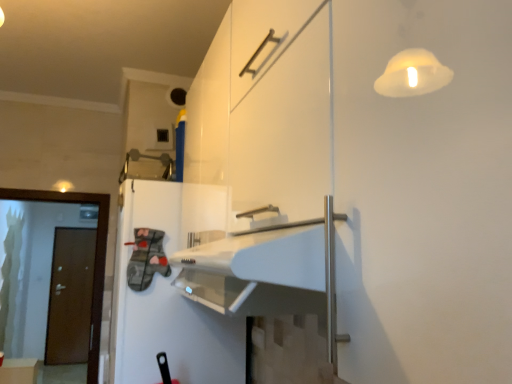
Question: From the image's perspective, relative to brown matte door at left, is brown matte door at left above or below?

Choices:
 (A) below
 (B) above

Answer: (B)

Question: Considering the positions of brown matte door at left and brown matte door at left in the image, is brown matte door at left bigger or smaller than brown matte door at left?

Choices:
 (A) small
 (B) big

Answer: (A)

Question: Which object is positioned closest to the white glossy refrigerator at center?

Choices:
 (A) matte white cabinet at lower left
 (B) brown matte door at left
 (C) brown matte door at left

Answer: (C)

Question: Considering the real-world distances, which object is closest to the brown matte door at left?

Choices:
 (A) brown matte door at left
 (B) matte white cabinet at lower left
 (C) white glossy refrigerator at center

Answer: (B)